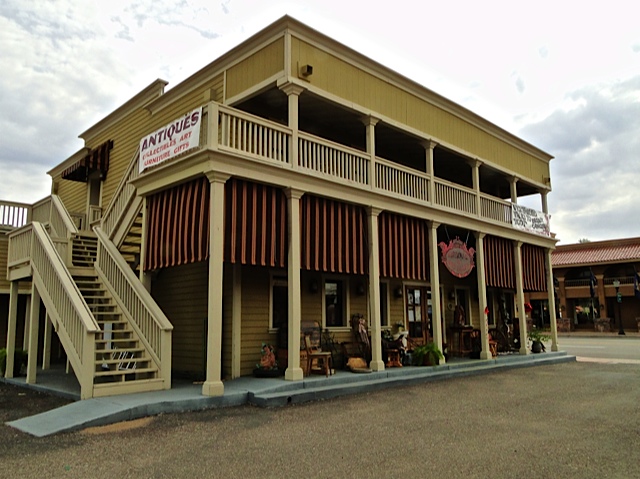
Image resolution: width=640 pixels, height=479 pixels. What are the coordinates of `door` in the screenshot? It's located at (413, 308).